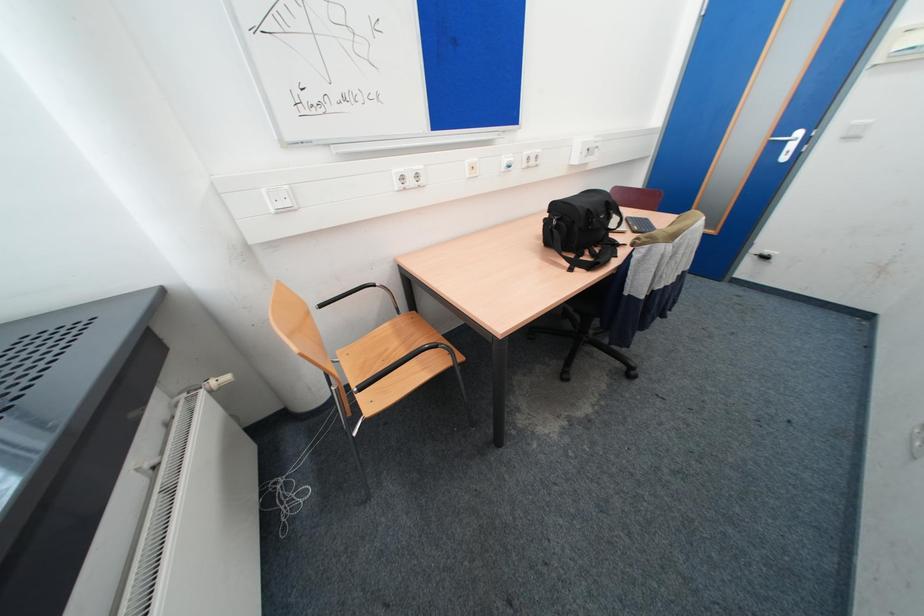
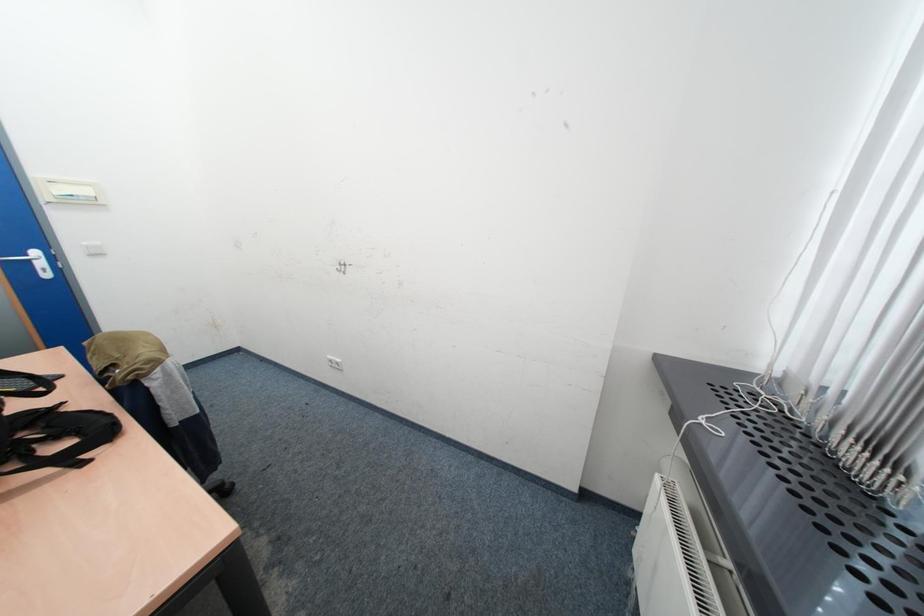
First-person continuous shooting, in which direction is the camera rotating?

The camera rotated toward right-down.